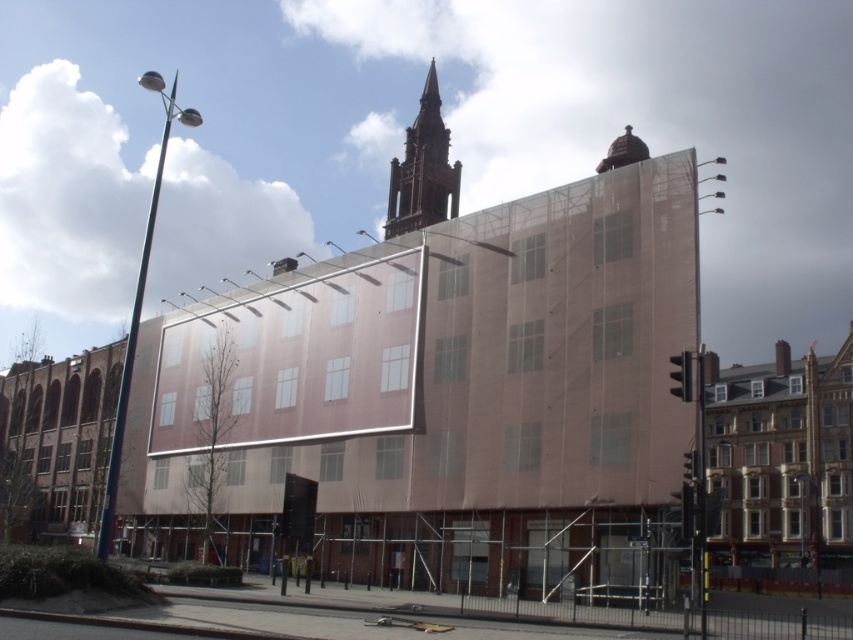
Question: Can you confirm if brown stone church at center is positioned to the left of golden stone church at right?

Choices:
 (A) no
 (B) yes

Answer: (B)

Question: Estimate the real-world distances between objects in this image. Which object is closer to the brown stone tower at upper center?

Choices:
 (A) brown stone church at center
 (B) golden stone church at right

Answer: (A)

Question: Which object appears closest to the camera in this image?

Choices:
 (A) brown stone church at center
 (B) brown stone tower at upper center

Answer: (A)

Question: Observing the image, what is the correct spatial positioning of golden stone church at right in reference to brown stone tower at upper center?

Choices:
 (A) below
 (B) above

Answer: (A)

Question: Considering the real-world distances, which object is closest to the brown stone church at center?

Choices:
 (A) brown stone tower at upper center
 (B) golden stone church at right

Answer: (A)

Question: Does brown stone church at center come in front of golden stone church at right?

Choices:
 (A) no
 (B) yes

Answer: (A)